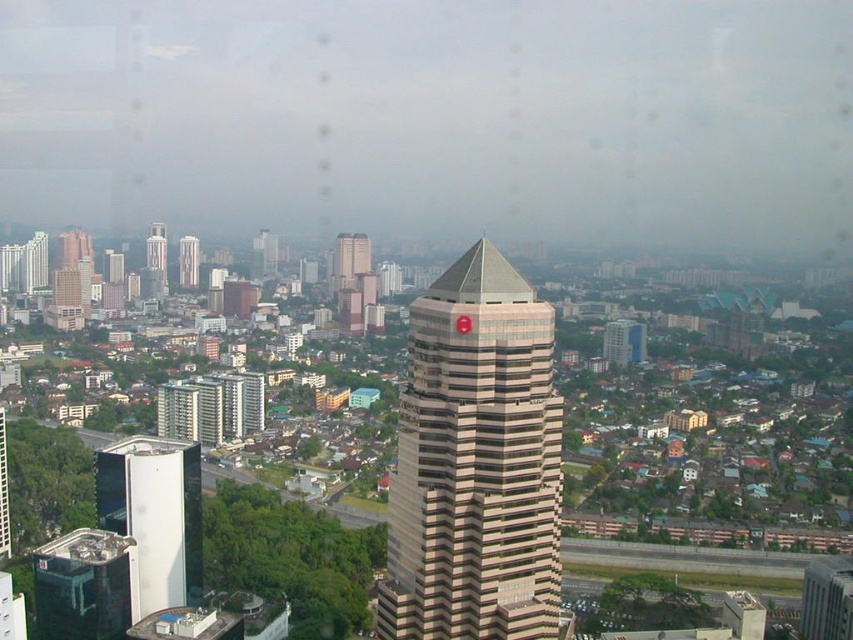
Who is more distant from viewer, (349,260) or (148,243)?

Positioned behind is point (148,243).

Is light beige concrete building at center smaller than beige concrete building at left?

Actually, light beige concrete building at center might be larger than beige concrete building at left.

The width and height of the screenshot is (853, 640). In order to click on light beige concrete building at center in this screenshot , I will do `click(349, 260)`.

Can you confirm if beige striped tower at center is positioned to the left of white glass tower at lower left?

In fact, beige striped tower at center is to the right of white glass tower at lower left.

Does beige striped tower at center have a lesser height compared to white glass tower at lower left?

Incorrect, beige striped tower at center's height does not fall short of white glass tower at lower left's.

Between point (469, 580) and point (193, 589), which one is positioned behind?

The point (193, 589) is more distant.

At what (x,y) coordinates should I click in order to perform the action: click on beige striped tower at center. Please return your answer as a coordinate pair (x, y). Looking at the image, I should click on (474, 464).

Is beige striped tower at center to the right of light beige concrete building at center from the viewer's perspective?

Correct, you'll find beige striped tower at center to the right of light beige concrete building at center.

Measure the distance between point (450, 355) and camera.

108.52 meters

The width and height of the screenshot is (853, 640). What are the coordinates of `beige striped tower at center` in the screenshot? It's located at (474, 464).